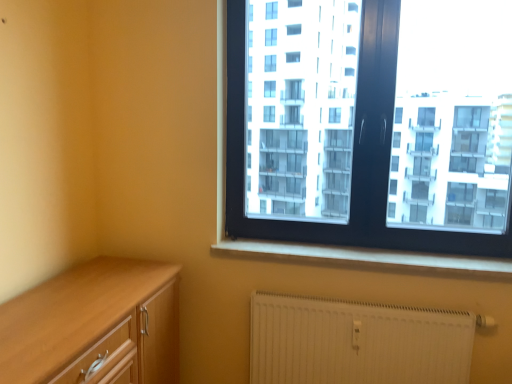
Question: In the image, is white textured radiator at lower right positioned in front of or behind light wood cabinet at lower left?

Choices:
 (A) front
 (B) behind

Answer: (B)

Question: In terms of size, does white textured radiator at lower right appear bigger or smaller than light wood cabinet at lower left?

Choices:
 (A) small
 (B) big

Answer: (A)

Question: Estimate the real-world distances between objects in this image. Which object is closer to the white smooth window sill at lower center?

Choices:
 (A) black plastic window at upper right
 (B) white textured radiator at lower right
 (C) light wood cabinet at lower left

Answer: (B)

Question: Which object is the farthest from the black plastic window at upper right?

Choices:
 (A) white smooth window sill at lower center
 (B) white textured radiator at lower right
 (C) light wood cabinet at lower left

Answer: (C)